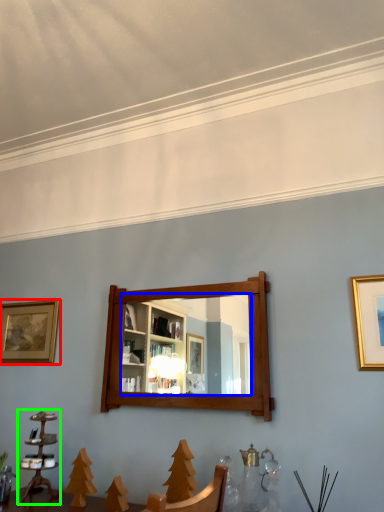
Question: Which object is the farthest from picture frame (highlighted by a red box)? Choose among these: mirror (highlighted by a blue box) or candle holder (highlighted by a green box).

Choices:
 (A) mirror
 (B) candle holder

Answer: (A)